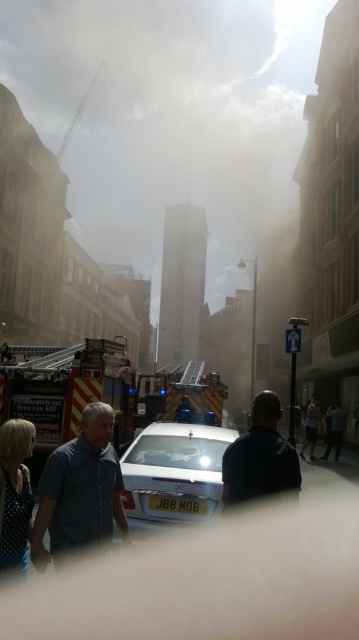
You are a pedestrian standing on the sidewalk and see the white glossy car at center and the dark blue jeans at center. Which object is taller?

The white glossy car at center is much taller than the dark blue jeans at center.

You are a delivery person who needs to place a package between the white glossy car at center and the dark blue jeans at center. What is the minimum distance you need to cover to place the package in between them?

The minimum distance you need to cover to place the package between the white glossy car at center and the dark blue jeans at center is 11.48 meters, as they are 11.48 meters apart from each other.

You are a delivery driver who needs to navigate through the city center shown in the image. There is a yellow reflective fire truck at left located at point (72, 390). Can you safely pass around it without blocking the road?

The yellow reflective fire truck at left is located at point (72, 390). Since it is a fire truck, you should not block the road and must yield, allowing it to proceed first before attempting to pass.